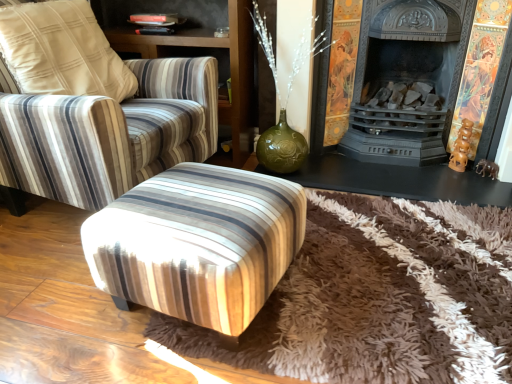
The image size is (512, 384). What are the coordinates of `empty space that is in between wooden stool at center and matte black fireplace at center` in the screenshot? It's located at (376, 244).